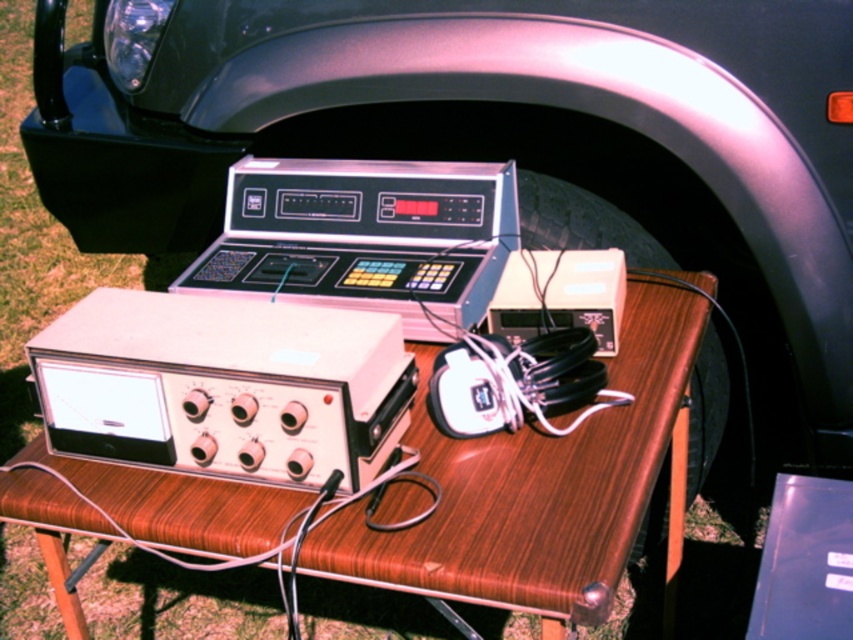
Question: Does wooden table at center lie in front of metallic silver calculator at center?

Choices:
 (A) no
 (B) yes

Answer: (B)

Question: Is wooden table at center bigger than metallic silver calculator at center?

Choices:
 (A) yes
 (B) no

Answer: (A)

Question: Which object is closer to the camera taking this photo?

Choices:
 (A) metallic silver calculator at center
 (B) wooden table at center

Answer: (B)

Question: Can you confirm if wooden table at center is bigger than metallic silver calculator at center?

Choices:
 (A) no
 (B) yes

Answer: (B)